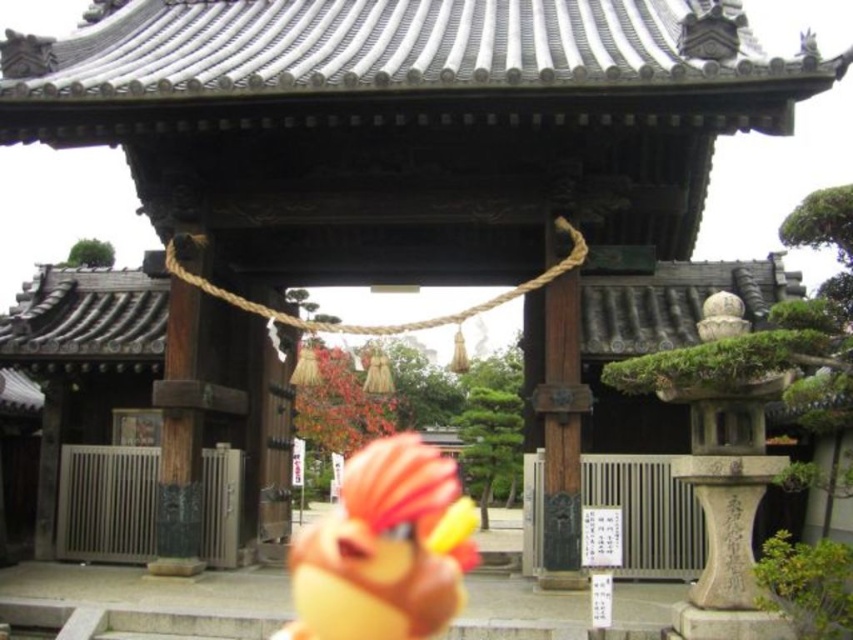
Question: Considering the relative positions of matte orange plush toy at center and wooden post at center in the image provided, where is matte orange plush toy at center located with respect to wooden post at center?

Choices:
 (A) right
 (B) left

Answer: (B)

Question: Which point is farther to the camera?

Choices:
 (A) (544, 492)
 (B) (349, 461)

Answer: (B)

Question: Can you confirm if matte orange plush toy at center is positioned below wooden post at center?

Choices:
 (A) no
 (B) yes

Answer: (B)

Question: Does matte orange plush toy at center have a lesser width compared to wooden post at center?

Choices:
 (A) yes
 (B) no

Answer: (B)

Question: Which object appears closest to the camera in this image?

Choices:
 (A) wooden post at center
 (B) matte orange plush toy at center

Answer: (B)

Question: Among these objects, which one is nearest to the camera?

Choices:
 (A) matte orange plush toy at center
 (B) wooden post at center

Answer: (A)